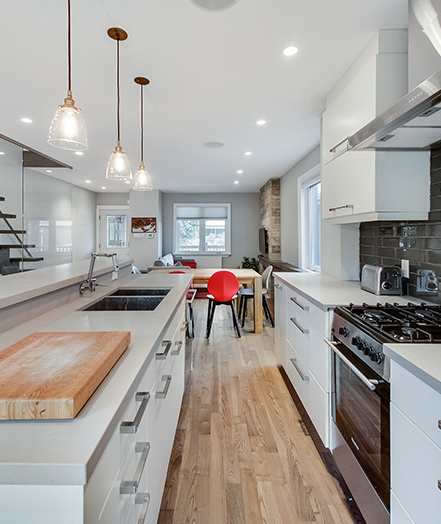
Image resolution: width=441 pixels, height=524 pixels. Find the location of `cabinet doors`. cabinet doors is located at coordinates (163, 428), (177, 365), (184, 337), (278, 315), (351, 190), (356, 119).